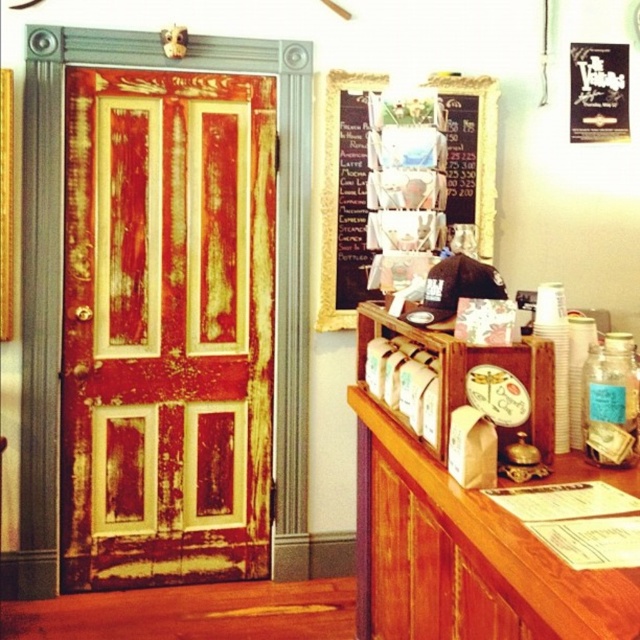
Question: Which object appears closest to the camera in this image?

Choices:
 (A) rusty wood door at left
 (B) chalkboard menu at upper center

Answer: (A)

Question: Among these objects, which one is nearest to the camera?

Choices:
 (A) chalkboard menu at upper center
 (B) rusty wood door at left

Answer: (B)

Question: Which of the following is the farthest from the observer?

Choices:
 (A) (138, 579)
 (B) (344, 312)

Answer: (B)

Question: Observing the image, what is the correct spatial positioning of rusty wood door at left in reference to chalkboard menu at upper center?

Choices:
 (A) left
 (B) right

Answer: (A)

Question: Is rusty wood door at left thinner than chalkboard menu at upper center?

Choices:
 (A) yes
 (B) no

Answer: (B)

Question: Can you confirm if rusty wood door at left is smaller than chalkboard menu at upper center?

Choices:
 (A) no
 (B) yes

Answer: (A)